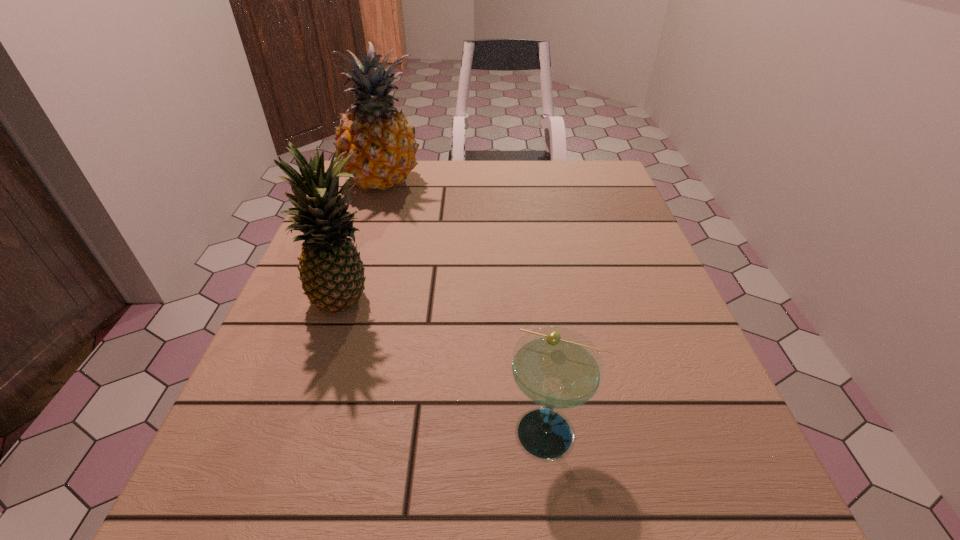
Find the location of a particular element. Image resolution: width=960 pixels, height=540 pixels. free space at the left edge of the desktop is located at coordinates (367, 318).

The image size is (960, 540). In the image, there is a desktop. Find the location of `vacant space at the right edge`. vacant space at the right edge is located at coordinates (602, 315).

Where is `vacant area at the far right corner of the desktop`? The height and width of the screenshot is (540, 960). vacant area at the far right corner of the desktop is located at coordinates (565, 161).

Locate an element on the screen. The width and height of the screenshot is (960, 540). free space between the farther pineapple and the martini is located at coordinates (468, 307).

Where is `free space between the farthest object and the second nearest object`? free space between the farthest object and the second nearest object is located at coordinates (365, 242).

I want to click on blank region between the farthest object and the nearest object, so click(468, 307).

Image resolution: width=960 pixels, height=540 pixels. In order to click on blank region between the farthest object and the nearer pineapple in this screenshot , I will do `click(365, 242)`.

Locate an element on the screen. This screenshot has height=540, width=960. unoccupied area between the farther pineapple and the martini is located at coordinates (468, 307).

Where is `free area in between the nearest object and the farthest object`? The width and height of the screenshot is (960, 540). free area in between the nearest object and the farthest object is located at coordinates (468, 307).

Where is `empty location between the farthest object and the nearest object`? The width and height of the screenshot is (960, 540). empty location between the farthest object and the nearest object is located at coordinates (468, 307).